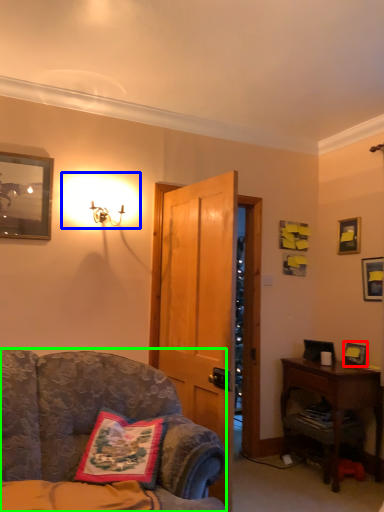
Question: Based on their relative distances, which object is farther from picture frame (highlighted by a red box)? Choose from lighting (highlighted by a blue box) and chair (highlighted by a green box).

Choices:
 (A) lighting
 (B) chair

Answer: (A)